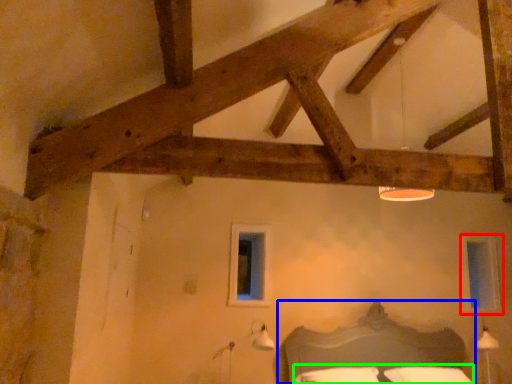
Question: Which object is the closest to the window (highlighted by a red box)? Choose among these: bed (highlighted by a blue box) or bedding (highlighted by a green box).

Choices:
 (A) bed
 (B) bedding

Answer: (A)